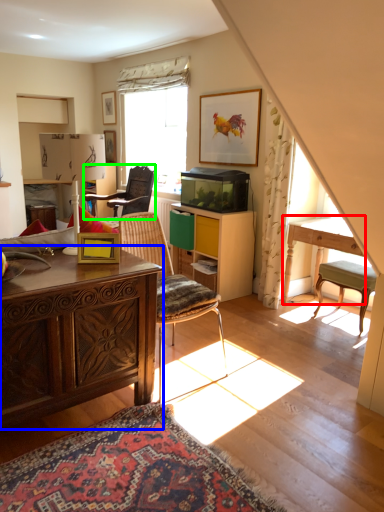
Question: Based on their relative distances, which object is farther from table (highlighted by a red box)? Choose from desk (highlighted by a blue box) and chair (highlighted by a green box).

Choices:
 (A) desk
 (B) chair

Answer: (B)